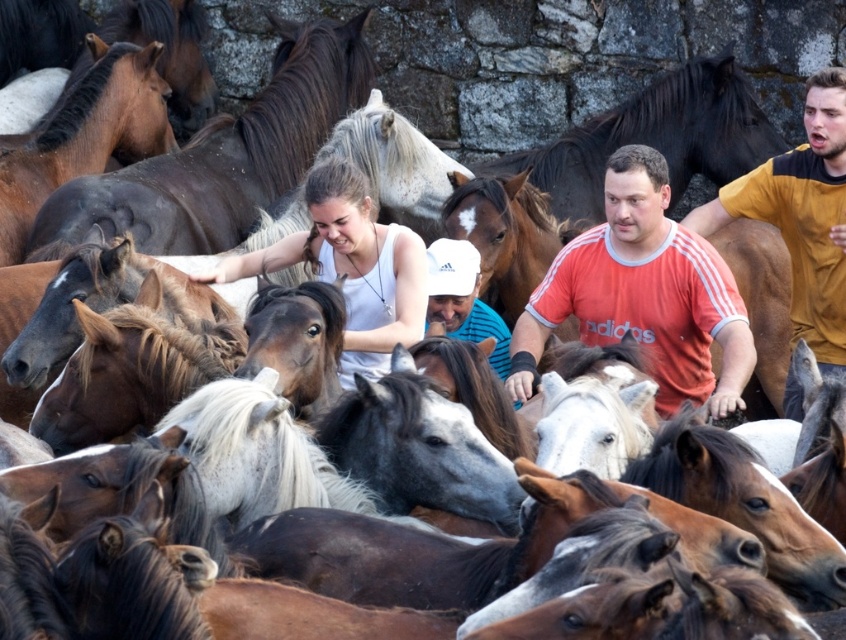
Does point (798, 173) come farther from viewer compared to point (221, 269)?

Yes, point (798, 173) is farther from viewer.

Is point (822, 252) positioned in front of point (404, 296)?

No, it is not.

I want to click on yellow cotton shirt at right, so [801, 216].

Can you confirm if orange cotton shirt at center is positioned above white matte tank top at center?

Incorrect, orange cotton shirt at center is not positioned above white matte tank top at center.

Is orange cotton shirt at center taller than white matte tank top at center?

Yes, orange cotton shirt at center is taller than white matte tank top at center.

Between point (531, 326) and point (248, 266), which one is positioned in front?

Point (531, 326) is in front.

Where is `orange cotton shirt at center`? orange cotton shirt at center is located at coordinates (643, 294).

Can you confirm if orange cotton shirt at center is positioned to the right of white matte cap at center?

Yes, orange cotton shirt at center is to the right of white matte cap at center.

Which is in front, point (619, 192) or point (448, 288)?

Point (619, 192) is more forward.

What are the coordinates of `orange cotton shirt at center` in the screenshot? It's located at (643, 294).